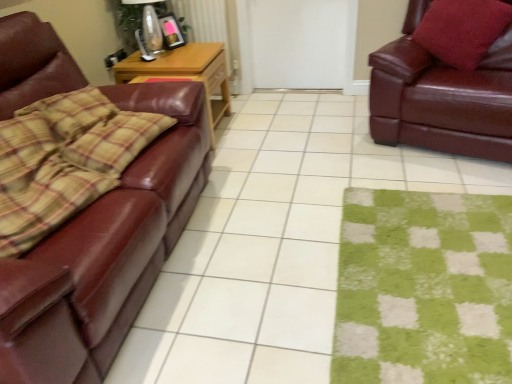
Question: Can you confirm if matte brown leather couch at left is wider than shiny brown leather couch at right, positioned as the 2th studio couch in left-to-right order?

Choices:
 (A) yes
 (B) no

Answer: (A)

Question: Is matte brown leather couch at left positioned before shiny brown leather couch at right, acting as the 1th studio couch starting from the right?

Choices:
 (A) no
 (B) yes

Answer: (B)

Question: Is matte brown leather couch at left looking in the opposite direction of shiny brown leather couch at right, positioned as the 2th studio couch in left-to-right order?

Choices:
 (A) no
 (B) yes

Answer: (A)

Question: From the image's perspective, would you say matte brown leather couch at left is positioned over shiny brown leather couch at right, acting as the 1th studio couch starting from the right?

Choices:
 (A) yes
 (B) no

Answer: (B)

Question: Is matte brown leather couch at left oriented towards shiny brown leather couch at right, positioned as the 2th studio couch in left-to-right order?

Choices:
 (A) no
 (B) yes

Answer: (A)

Question: From a real-world perspective, is matte brown leather couch at left below shiny brown leather couch at right, positioned as the 2th studio couch in left-to-right order?

Choices:
 (A) no
 (B) yes

Answer: (B)

Question: Considering the relative sizes of shiny brown leather couch at right, acting as the 1th studio couch starting from the right, and matte glass lamp at upper center in the image provided, is shiny brown leather couch at right, acting as the 1th studio couch starting from the right, wider than matte glass lamp at upper center?

Choices:
 (A) yes
 (B) no

Answer: (A)

Question: Are shiny brown leather couch at right, positioned as the 2th studio couch in left-to-right order, and matte glass lamp at upper center located far from each other?

Choices:
 (A) no
 (B) yes

Answer: (B)

Question: Does shiny brown leather couch at right, acting as the 1th studio couch starting from the right, have a greater height compared to matte glass lamp at upper center?

Choices:
 (A) yes
 (B) no

Answer: (A)

Question: Is shiny brown leather couch at right, acting as the 1th studio couch starting from the right, positioned before matte glass lamp at upper center?

Choices:
 (A) no
 (B) yes

Answer: (B)

Question: Does shiny brown leather couch at right, acting as the 1th studio couch starting from the right, have a lesser width compared to matte glass lamp at upper center?

Choices:
 (A) no
 (B) yes

Answer: (A)

Question: From a real-world perspective, is shiny brown leather couch at right, acting as the 1th studio couch starting from the right, physically below matte glass lamp at upper center?

Choices:
 (A) no
 (B) yes

Answer: (B)

Question: Considering the relative sizes of matte brown leather couch at left and shiny brown leather couch at left, marked as the 1th studio couch in a left-to-right arrangement, in the image provided, is matte brown leather couch at left thinner than shiny brown leather couch at left, marked as the 1th studio couch in a left-to-right arrangement,?

Choices:
 (A) no
 (B) yes

Answer: (A)